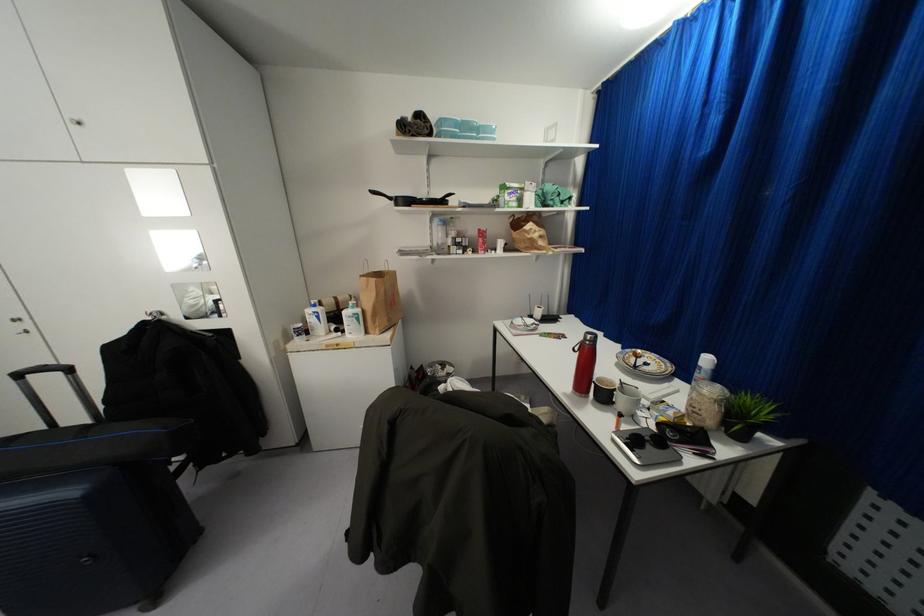
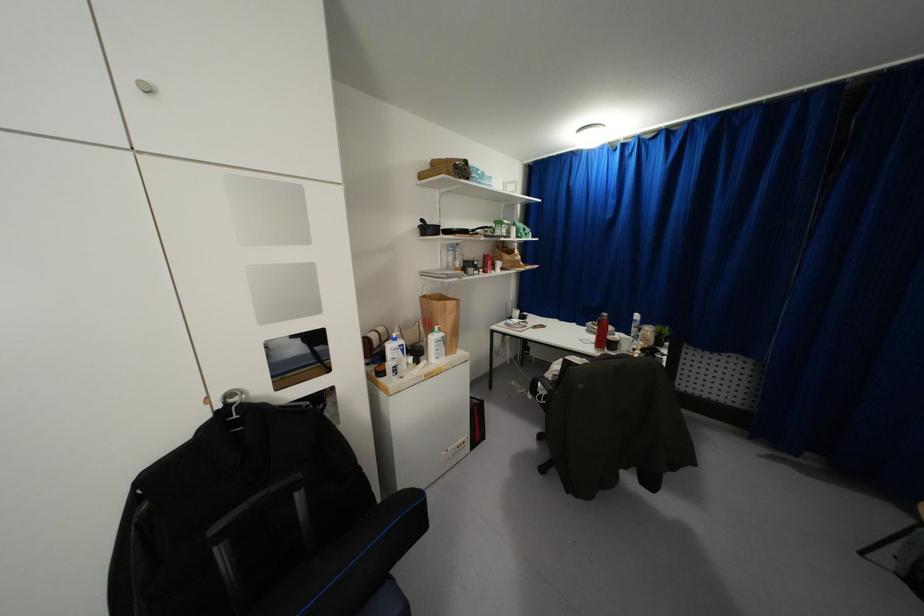
The point at (589,336) is marked in the first image. Where is the corresponding point in the second image?

(603, 314)